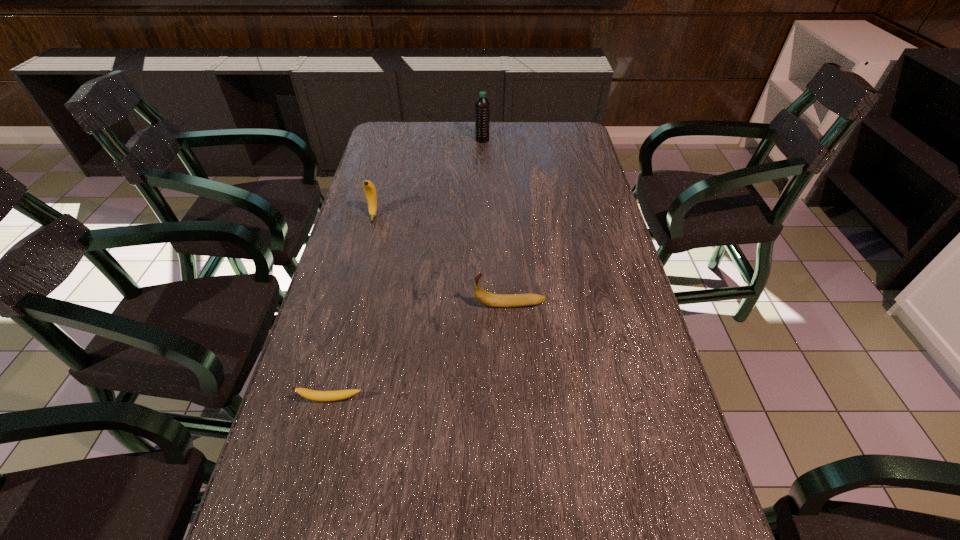
This screenshot has width=960, height=540. Identify the location of object that is the second closest to the second nearest banana. (370, 191).

I want to click on banana that is the closest to the shortest object, so click(x=486, y=298).

At what (x,y) coordinates should I click in order to perform the action: click on banana that stands as the second closest to the second shortest object. Please return your answer as a coordinate pair (x, y). This screenshot has width=960, height=540. Looking at the image, I should click on (370, 191).

The image size is (960, 540). Find the location of `vacant point that satisfies the following two spatial constraints: 1. at the stem of the second tallest banana; 2. on the upward curve of the shortest object`. vacant point that satisfies the following two spatial constraints: 1. at the stem of the second tallest banana; 2. on the upward curve of the shortest object is located at coordinates (516, 399).